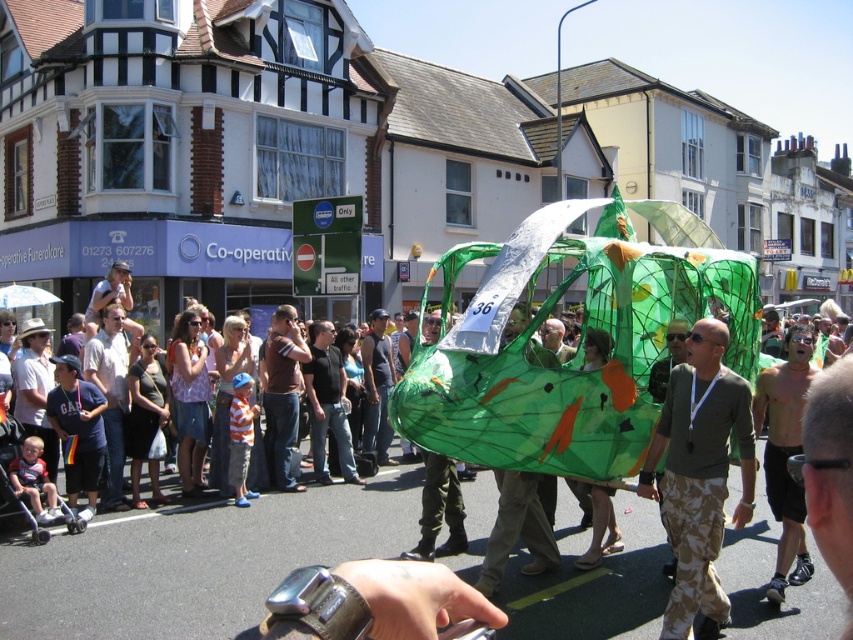
Is point (430, 317) behind point (375, 356)?

No.

Does green fabric dragon at center lie in front of dark brown leather jacket at center?

Yes.

Which is behind, point (436, 320) or point (366, 356)?

Positioned behind is point (366, 356).

The width and height of the screenshot is (853, 640). I want to click on green fabric dragon at center, so click(x=439, y=509).

Is green camouflage pants at center smaller than light brown cotton shirt at center?

Yes.

Between point (715, 500) and point (105, 342), which one is positioned in front?

Point (715, 500)

Image resolution: width=853 pixels, height=640 pixels. I want to click on green camouflage pants at center, so click(699, 476).

Can you confirm if green fabric kite at center is positioned above dark brown leather jacket at center?

No.

Based on the photo, between green fabric kite at center and dark brown leather jacket at center, which one is positioned lower?

green fabric kite at center

Is point (523, 312) less distant than point (386, 400)?

Yes.

Identify the location of green fabric kite at center. The image size is (853, 640). tap(517, 529).